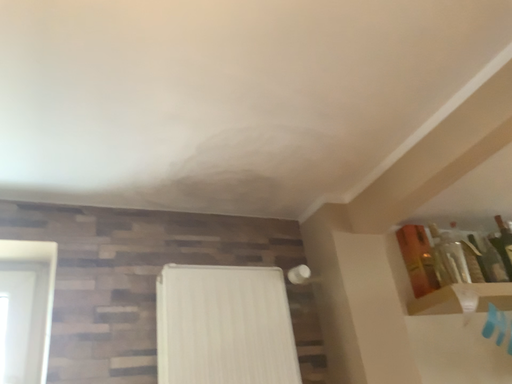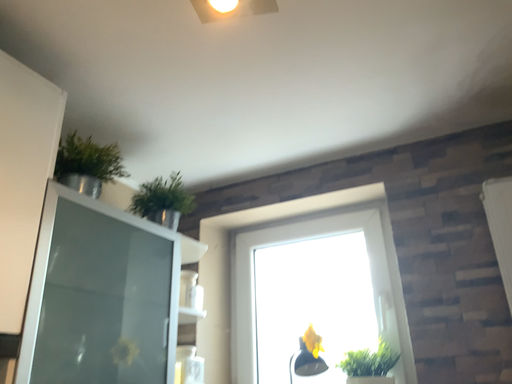
Question: How did the camera likely rotate when shooting the video?

Choices:
 (A) rotated downward
 (B) rotated upward

Answer: (A)